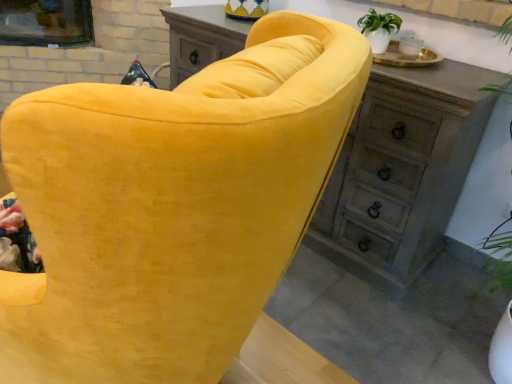
Question: Visually, is wooden dresser at center positioned to the left or to the right of wooden chest of drawers at upper center?

Choices:
 (A) left
 (B) right

Answer: (B)

Question: Is wooden dresser at center bigger or smaller than wooden chest of drawers at upper center?

Choices:
 (A) big
 (B) small

Answer: (B)

Question: Estimate the real-world distances between objects in this image. Which object is farther from the wooden chest of drawers at upper center?

Choices:
 (A) wooden dresser at center
 (B) velvet yellow sofa at center

Answer: (B)

Question: Based on their relative distances, which object is farther from the wooden dresser at center?

Choices:
 (A) velvet yellow sofa at center
 (B) wooden chest of drawers at upper center

Answer: (A)